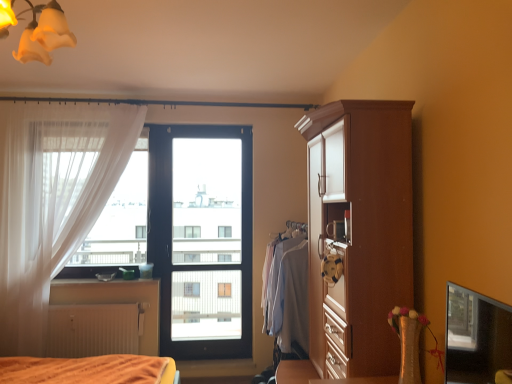
You are a GUI agent. You are given a task and a screenshot of the screen. Output one action in this format:
    pyautogui.click(x=<x>, y=<y>)
    Task: Click on the vacant space situated above matte black window sill at lower left (from a real-world perspective)
    The width and height of the screenshot is (512, 384).
    Given the screenshot: What is the action you would take?
    pyautogui.click(x=105, y=278)